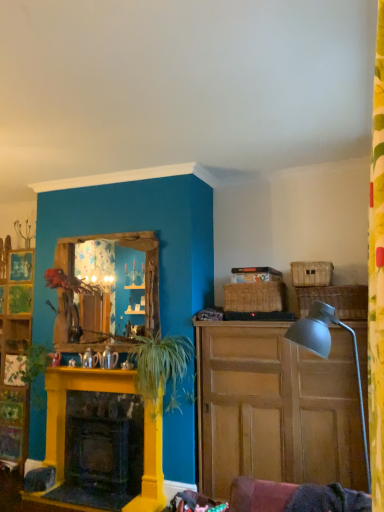
Question: Does wooden mirror at center come behind green leafy plant at center, positioned as the second plant in left-to-right order?

Choices:
 (A) yes
 (B) no

Answer: (A)

Question: Is wooden mirror at center placed right next to green leafy plant at center, which is the 1th plant in right-to-left order?

Choices:
 (A) no
 (B) yes

Answer: (A)

Question: From the image's perspective, is wooden mirror at center located beneath green leafy plant at center, which is the 1th plant in right-to-left order?

Choices:
 (A) yes
 (B) no

Answer: (B)

Question: Does wooden mirror at center come in front of green leafy plant at center, which is the 1th plant in right-to-left order?

Choices:
 (A) yes
 (B) no

Answer: (B)

Question: Is wooden mirror at center bigger than green leafy plant at center, positioned as the second plant in left-to-right order?

Choices:
 (A) yes
 (B) no

Answer: (B)

Question: From the image's perspective, relative to wooden mirror at center, is wooden cabinet at right above or below?

Choices:
 (A) above
 (B) below

Answer: (B)

Question: Relative to wooden mirror at center, is wooden cabinet at right in front or behind?

Choices:
 (A) behind
 (B) front

Answer: (B)

Question: Does point (297, 438) appear closer or farther from the camera than point (132, 296)?

Choices:
 (A) closer
 (B) farther

Answer: (A)

Question: In terms of size, does wooden cabinet at right appear bigger or smaller than wooden mirror at center?

Choices:
 (A) small
 (B) big

Answer: (B)

Question: From the image's perspective, is yellow painted wood fireplace at lower left located above or below wooden cabinet at right?

Choices:
 (A) above
 (B) below

Answer: (B)

Question: Considering their positions, is yellow painted wood fireplace at lower left located in front of or behind wooden cabinet at right?

Choices:
 (A) behind
 (B) front

Answer: (A)

Question: Considering the positions of yellow painted wood fireplace at lower left and wooden cabinet at right in the image, is yellow painted wood fireplace at lower left taller or shorter than wooden cabinet at right?

Choices:
 (A) short
 (B) tall

Answer: (A)

Question: Considering the positions of point (79, 496) and point (266, 458), is point (79, 496) closer or farther from the camera than point (266, 458)?

Choices:
 (A) closer
 (B) farther

Answer: (B)

Question: Is woven wicker picnic basket at right, which is the 1th picnic basket from right to left, situated inside green leafy plant at center, which is the 1th plant in right-to-left order, or outside?

Choices:
 (A) inside
 (B) outside

Answer: (B)

Question: In terms of size, does woven wicker picnic basket at right, the 3th picnic basket viewed from the left, appear bigger or smaller than green leafy plant at center, positioned as the second plant in left-to-right order?

Choices:
 (A) big
 (B) small

Answer: (B)